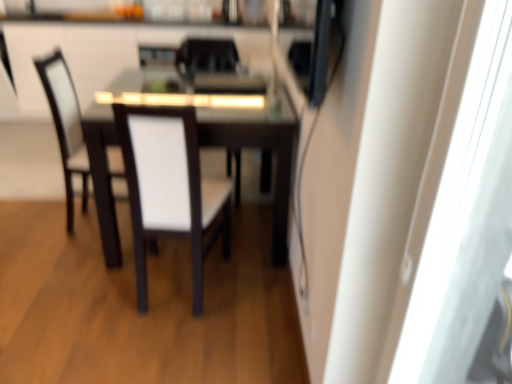
Where is `free space in front of white fabric chair at center, which is the 1th chair from front to back`? The width and height of the screenshot is (512, 384). free space in front of white fabric chair at center, which is the 1th chair from front to back is located at coordinates (162, 342).